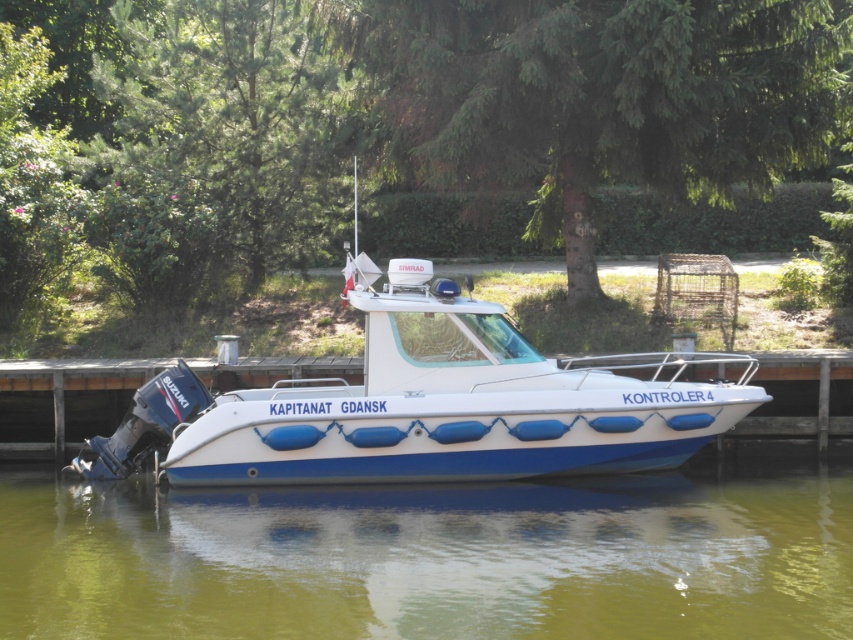
You are standing on the wooden pier and looking at the white glossy boat at center. Where is the greenish water at lower center located relative to the boat?

The greenish water at lower center is to the right of the white glossy boat at center.

You are a crane operator tasked with lifting the white glossy boat at center and moving it over the white wood dock at center. Considering their heights, will the boat clear the dock without any collision during the lift?

The white glossy boat at center is much taller than the white wood dock at center, so when lifted, the boat will not clear the dock and may collide during the operation. Adjust the crane path or lower the dock height to avoid collision.

You are a port authority inspector standing at the wooden pier. You need to board the white glossy boat at center for an inspection. Based on its current position, can you estimate whether the boat is closer to the front or the back of the pier?

The white glossy boat at center is located at point coordinates, which would indicate its position relative to the pier. However, without specific spatial references or dimensions of the pier, it is impossible to determine if the boat is closer to the front or back based solely on the provided coordinates. Additional information about the pier length or coordinate system orientation is needed to answer accurately.